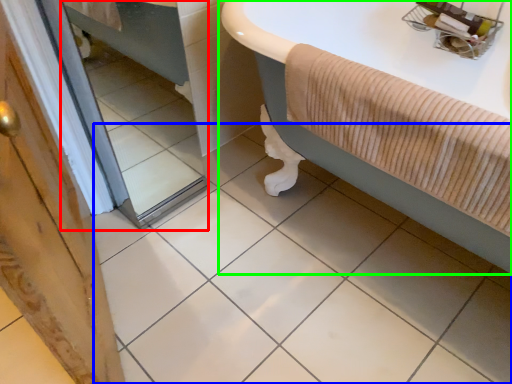
Question: Considering the real-world distances, which object is farthest from mirror (highlighted by a red box)? ceramic tile (highlighted by a blue box) or bathtub (highlighted by a green box)?

Choices:
 (A) ceramic tile
 (B) bathtub

Answer: (B)